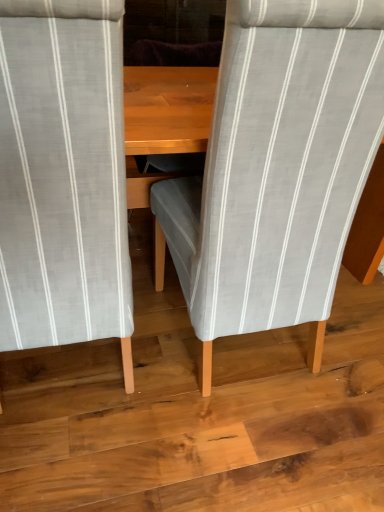
I want to click on wooden floor at center, so click(199, 415).

Considering the sizes of light gray striped fabric chair at center, the first chair positioned from the right, and wooden floor at center in the image, is light gray striped fabric chair at center, the first chair positioned from the right, taller or shorter than wooden floor at center?

light gray striped fabric chair at center, the first chair positioned from the right, is taller than wooden floor at center.

From a real-world perspective, between light gray striped fabric chair at center, placed as the 2th chair when sorted from left to right, and wooden floor at center, who is vertically higher?

In real-world perspective, light gray striped fabric chair at center, placed as the 2th chair when sorted from left to right, is above.

Can you tell me how much light gray striped fabric chair at center, placed as the 2th chair when sorted from left to right, and wooden floor at center differ in facing direction?

The angle between the facing direction of light gray striped fabric chair at center, placed as the 2th chair when sorted from left to right, and the facing direction of wooden floor at center is 93.1 degrees.

Would you say light gray striped fabric chair at center, the first chair positioned from the right, is inside or outside wooden floor at center?

light gray striped fabric chair at center, the first chair positioned from the right, is outside wooden floor at center.

From a real-world perspective, is light gray striped fabric chair at center, which is the first chair in left-to-right order, above or below wooden floor at center?

Clearly, from a real-world perspective, light gray striped fabric chair at center, which is the first chair in left-to-right order, is above wooden floor at center.

Which is more to the right, light gray striped fabric chair at center, the second chair when ordered from right to left, or wooden floor at center?

wooden floor at center is more to the right.

Is light gray striped fabric chair at center, which is the first chair in left-to-right order, situated inside wooden floor at center or outside?

light gray striped fabric chair at center, which is the first chair in left-to-right order, is not inside wooden floor at center, it's outside.

From a real-world perspective, is light gray striped fabric chair at center, which is the first chair in left-to-right order, under light gray striped fabric chair at center, the first chair positioned from the right?

Yes, from a real-world perspective, light gray striped fabric chair at center, which is the first chair in left-to-right order, is under light gray striped fabric chair at center, the first chair positioned from the right.

From the picture: Is light gray striped fabric chair at center, the second chair when ordered from right to left, located outside light gray striped fabric chair at center, the first chair positioned from the right?

Indeed, light gray striped fabric chair at center, the second chair when ordered from right to left, is completely outside light gray striped fabric chair at center, the first chair positioned from the right.

Does point (123, 315) come behind point (321, 261)?

Yes, point (123, 315) is behind point (321, 261).

How different are the orientations of light gray striped fabric chair at center, the second chair when ordered from right to left, and light gray striped fabric chair at center, the first chair positioned from the right, in degrees?

There is a 2.38e-05-degree angle between the facing directions of light gray striped fabric chair at center, the second chair when ordered from right to left, and light gray striped fabric chair at center, the first chair positioned from the right.

From the image's perspective, is light gray striped fabric chair at center, placed as the 2th chair when sorted from left to right, above or below light gray striped fabric chair at center, which is the first chair in left-to-right order?

From the image's perspective, light gray striped fabric chair at center, placed as the 2th chair when sorted from left to right, appears above light gray striped fabric chair at center, which is the first chair in left-to-right order.

Identify the location of chair on the left of light gray striped fabric chair at center, placed as the 2th chair when sorted from left to right. (63, 176).

Between light gray striped fabric chair at center, placed as the 2th chair when sorted from left to right, and light gray striped fabric chair at center, the second chair when ordered from right to left, which one has less height?

With less height is light gray striped fabric chair at center, the second chair when ordered from right to left.

Looking at this image, between light gray striped fabric chair at center, the first chair positioned from the right, and light gray striped fabric chair at center, which is the first chair in left-to-right order, which one has smaller width?

Thinner between the two is light gray striped fabric chair at center, which is the first chair in left-to-right order.

Could you tell me if wooden floor at center is facing light gray striped fabric chair at center, the second chair when ordered from right to left?

No, wooden floor at center is not facing towards light gray striped fabric chair at center, the second chair when ordered from right to left.

In terms of width, does wooden floor at center look wider or thinner when compared to light gray striped fabric chair at center, the second chair when ordered from right to left?

In the image, wooden floor at center appears to be wider than light gray striped fabric chair at center, the second chair when ordered from right to left.

Considering the sizes of wooden floor at center and light gray striped fabric chair at center, the second chair when ordered from right to left, in the image, is wooden floor at center bigger or smaller than light gray striped fabric chair at center, the second chair when ordered from right to left,?

Clearly, wooden floor at center is smaller in size than light gray striped fabric chair at center, the second chair when ordered from right to left.

From the image's perspective, which one is positioned lower, wooden floor at center or light gray striped fabric chair at center, the first chair positioned from the right?

From the image's view, wooden floor at center is below.

Between wooden floor at center and light gray striped fabric chair at center, the first chair positioned from the right, which one has larger size?

Bigger between the two is light gray striped fabric chair at center, the first chair positioned from the right.

Identify the location of plywood behind the light gray striped fabric chair at center, placed as the 2th chair when sorted from left to right. (199, 415).

Which of these two, wooden floor at center or light gray striped fabric chair at center, placed as the 2th chair when sorted from left to right, stands taller?

light gray striped fabric chair at center, placed as the 2th chair when sorted from left to right.

Identify the location of the 2nd chair above the wooden floor at center (from the image's perspective). This screenshot has height=512, width=384. (277, 169).

This screenshot has height=512, width=384. In order to click on plywood behind the light gray striped fabric chair at center, which is the first chair in left-to-right order in this screenshot , I will do (x=199, y=415).

Looking at the image, which one is located further to wooden floor at center, light gray striped fabric chair at center, the first chair positioned from the right, or light gray striped fabric chair at center, the second chair when ordered from right to left?

Based on the image, light gray striped fabric chair at center, the second chair when ordered from right to left, appears to be further to wooden floor at center.

From the image, which object appears to be farther from light gray striped fabric chair at center, which is the first chair in left-to-right order, wooden floor at center or light gray striped fabric chair at center, the first chair positioned from the right?

wooden floor at center is positioned further to the anchor light gray striped fabric chair at center, which is the first chair in left-to-right order.

When comparing their distances from light gray striped fabric chair at center, placed as the 2th chair when sorted from left to right, does light gray striped fabric chair at center, the second chair when ordered from right to left, or wooden floor at center seem closer?

light gray striped fabric chair at center, the second chair when ordered from right to left, is positioned closer to the anchor light gray striped fabric chair at center, placed as the 2th chair when sorted from left to right.

Considering their positions, is wooden floor at center positioned further to light gray striped fabric chair at center, placed as the 2th chair when sorted from left to right, than light gray striped fabric chair at center, the second chair when ordered from right to left?

wooden floor at center.

Considering their positions, is light gray striped fabric chair at center, which is the first chair in left-to-right order, positioned further to wooden floor at center than light gray striped fabric chair at center, the first chair positioned from the right?

light gray striped fabric chair at center, which is the first chair in left-to-right order, lies further to wooden floor at center than the other object.

When comparing their distances from light gray striped fabric chair at center, which is the first chair in left-to-right order, does light gray striped fabric chair at center, placed as the 2th chair when sorted from left to right, or wooden floor at center seem further?

wooden floor at center.

The height and width of the screenshot is (512, 384). Identify the location of chair between light gray striped fabric chair at center, which is the first chair in left-to-right order, and wooden floor at center, in the horizontal direction. (277, 169).